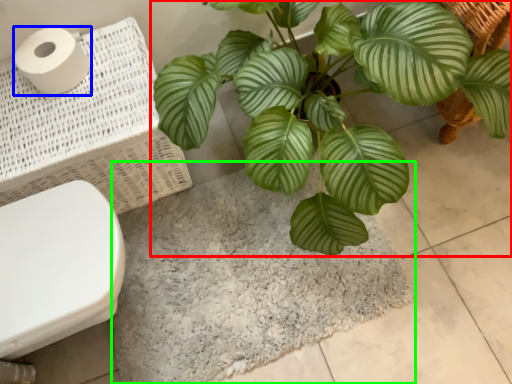
Question: Which object is positioned farthest from houseplant (highlighted by a red box)? Select from toilet paper (highlighted by a blue box) and bath mat (highlighted by a green box).

Choices:
 (A) toilet paper
 (B) bath mat

Answer: (A)